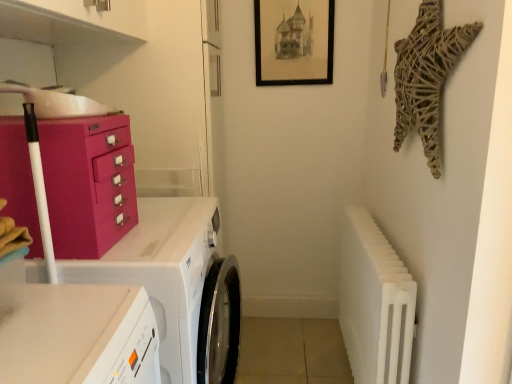
Describe the element at coordinates (374, 302) in the screenshot. I see `white ribbed radiator at right` at that location.

The image size is (512, 384). I want to click on white ribbed radiator at right, so click(374, 302).

Where is `matte pink cabinet at left`? The height and width of the screenshot is (384, 512). matte pink cabinet at left is located at coordinates (88, 183).

From the image's perspective, which one is positioned higher, white ribbed radiator at right or matte pink cabinet at left?

From the image's view, matte pink cabinet at left is above.

At what (x,y) coordinates should I click in order to perform the action: click on radiator lying on the right of matte pink cabinet at left. Please return your answer as a coordinate pair (x, y). This screenshot has height=384, width=512. Looking at the image, I should click on (374, 302).

Considering the sizes of objects white ribbed radiator at right and matte pink cabinet at left in the image provided, who is bigger, white ribbed radiator at right or matte pink cabinet at left?

white ribbed radiator at right.

From a real-world perspective, which object rests below the other?

matte pink cabinet at left is physically lower.

Considering the sizes of matte pink cabinet at left and black matte picture frame at upper center in the image, is matte pink cabinet at left wider or thinner than black matte picture frame at upper center?

In the image, matte pink cabinet at left appears to be wider than black matte picture frame at upper center.

Measure the distance from matte pink cabinet at left to black matte picture frame at upper center.

matte pink cabinet at left is 1.15 meters away from black matte picture frame at upper center.

Who is taller, matte pink cabinet at left or white glossy washing machine at lower left?

With more height is white glossy washing machine at lower left.

Is matte pink cabinet at left positioned beyond the bounds of white glossy washing machine at lower left?

Indeed, matte pink cabinet at left is completely outside white glossy washing machine at lower left.

From the image's perspective, is matte pink cabinet at left above or below white glossy washing machine at lower left?

From the image's perspective, matte pink cabinet at left appears above white glossy washing machine at lower left.

Could black matte picture frame at upper center be considered to be inside white ribbed radiator at right?

No, black matte picture frame at upper center is not a part of white ribbed radiator at right.

From a real-world perspective, who is located lower, white ribbed radiator at right or black matte picture frame at upper center?

white ribbed radiator at right, from a real-world perspective.

Consider the image. Would you consider white ribbed radiator at right to be distant from black matte picture frame at upper center?

No, white ribbed radiator at right is not far from black matte picture frame at upper center.

Is point (1, 182) behind point (411, 299)?

No, (1, 182) is in front of (411, 299).

Considering the sizes of objects matte pink cabinet at left and white ribbed radiator at right in the image provided, who is taller, matte pink cabinet at left or white ribbed radiator at right?

Standing taller between the two is white ribbed radiator at right.

Is matte pink cabinet at left further to camera compared to white ribbed radiator at right?

No.

From a real-world perspective, between matte pink cabinet at left and white ribbed radiator at right, who is vertically lower?

white ribbed radiator at right.

Identify the location of home appliance below the black matte picture frame at upper center (from the image's perspective). (163, 272).

Who is shorter, black matte picture frame at upper center or white glossy washing machine at lower left?

black matte picture frame at upper center.

From a real-world perspective, which object stands above the other?

black matte picture frame at upper center.

Based on the photo, would you say black matte picture frame at upper center is to the left or to the right of white glossy washing machine at lower left in the picture?

Clearly, black matte picture frame at upper center is on the right of white glossy washing machine at lower left in the image.

Considering the sizes of black matte picture frame at upper center and matte pink cabinet at left in the image, is black matte picture frame at upper center taller or shorter than matte pink cabinet at left?

Considering their sizes, black matte picture frame at upper center has more height than matte pink cabinet at left.

Is matte pink cabinet at left inside black matte picture frame at upper center?

No.

Does black matte picture frame at upper center have a greater width compared to matte pink cabinet at left?

In fact, black matte picture frame at upper center might be narrower than matte pink cabinet at left.

Considering the positions of objects black matte picture frame at upper center and matte pink cabinet at left in the image provided, who is more to the right, black matte picture frame at upper center or matte pink cabinet at left?

From the viewer's perspective, black matte picture frame at upper center appears more on the right side.

Where is `radiator behind the matte pink cabinet at left`? This screenshot has height=384, width=512. radiator behind the matte pink cabinet at left is located at coordinates (374, 302).

The height and width of the screenshot is (384, 512). I want to click on chest of drawers on the left of black matte picture frame at upper center, so click(88, 183).

When comparing their distances from matte pink cabinet at left, does white ribbed radiator at right or black matte picture frame at upper center seem closer?

white ribbed radiator at right is positioned closer to the anchor matte pink cabinet at left.

When comparing their distances from black matte picture frame at upper center, does white glossy washing machine at lower left or white ribbed radiator at right seem closer?

The object closer to black matte picture frame at upper center is white ribbed radiator at right.

From the image, which object appears to be farther from white ribbed radiator at right, matte pink cabinet at left or black matte picture frame at upper center?

Among the two, black matte picture frame at upper center is located further to white ribbed radiator at right.

When comparing their distances from white glossy washing machine at lower left, does white ribbed radiator at right or black matte picture frame at upper center seem further?

Based on the image, black matte picture frame at upper center appears to be further to white glossy washing machine at lower left.

Which object lies further to the anchor point white glossy washing machine at lower left, matte pink cabinet at left or white ribbed radiator at right?

white ribbed radiator at right is further to white glossy washing machine at lower left.

When comparing their distances from matte pink cabinet at left, does black matte picture frame at upper center or white glossy washing machine at lower left seem further?

The object further to matte pink cabinet at left is black matte picture frame at upper center.

Which object lies nearer to the anchor point white glossy washing machine at lower left, black matte picture frame at upper center or white ribbed radiator at right?

white ribbed radiator at right.

From the image, which object appears to be farther from black matte picture frame at upper center, matte pink cabinet at left or white ribbed radiator at right?

Among the two, matte pink cabinet at left is located further to black matte picture frame at upper center.

The height and width of the screenshot is (384, 512). I want to click on home appliance located between matte pink cabinet at left and white ribbed radiator at right in the left-right direction, so click(x=163, y=272).

Image resolution: width=512 pixels, height=384 pixels. I want to click on the chest of drawers between black matte picture frame at upper center and white ribbed radiator at right vertically, so click(x=88, y=183).

The width and height of the screenshot is (512, 384). Find the location of `chest of drawers between black matte picture frame at upper center and white glossy washing machine at lower left from top to bottom`. chest of drawers between black matte picture frame at upper center and white glossy washing machine at lower left from top to bottom is located at coordinates (88, 183).

The width and height of the screenshot is (512, 384). Find the location of `home appliance that lies between black matte picture frame at upper center and white ribbed radiator at right from top to bottom`. home appliance that lies between black matte picture frame at upper center and white ribbed radiator at right from top to bottom is located at coordinates (163, 272).